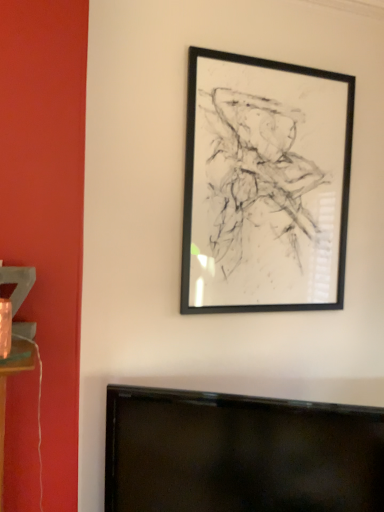
Where is `black matte picture frame at upper center`? The image size is (384, 512). black matte picture frame at upper center is located at coordinates (265, 185).

What do you see at coordinates (265, 185) in the screenshot? The width and height of the screenshot is (384, 512). I see `black matte picture frame at upper center` at bounding box center [265, 185].

Identify the location of black matte picture frame at upper center. Image resolution: width=384 pixels, height=512 pixels. (265, 185).